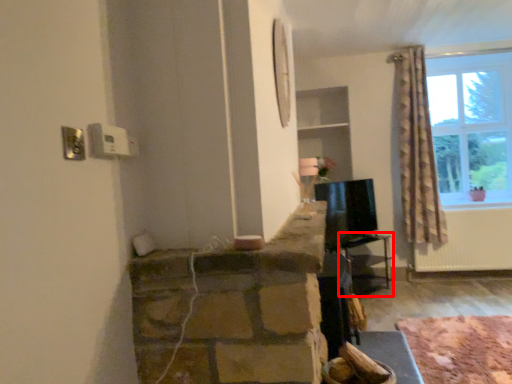
Question: From the image's perspective, where is table (annotated by the red box) located relative to plain?

Choices:
 (A) below
 (B) above

Answer: (B)